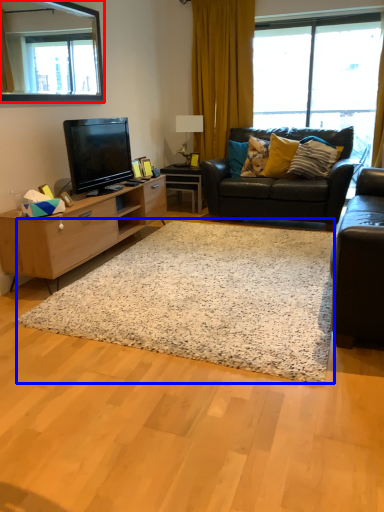
Question: Among these objects, which one is nearest to the camera, mirror (highlighted by a red box) or plain (highlighted by a blue box)?

Choices:
 (A) mirror
 (B) plain

Answer: (B)